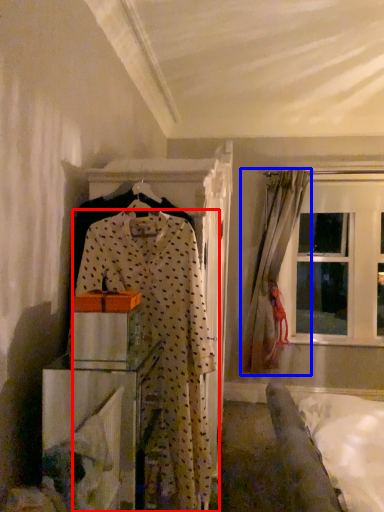
Question: Which point is further to the camera, fancy dress (highlighted by a red box) or curtain (highlighted by a blue box)?

Choices:
 (A) fancy dress
 (B) curtain

Answer: (B)